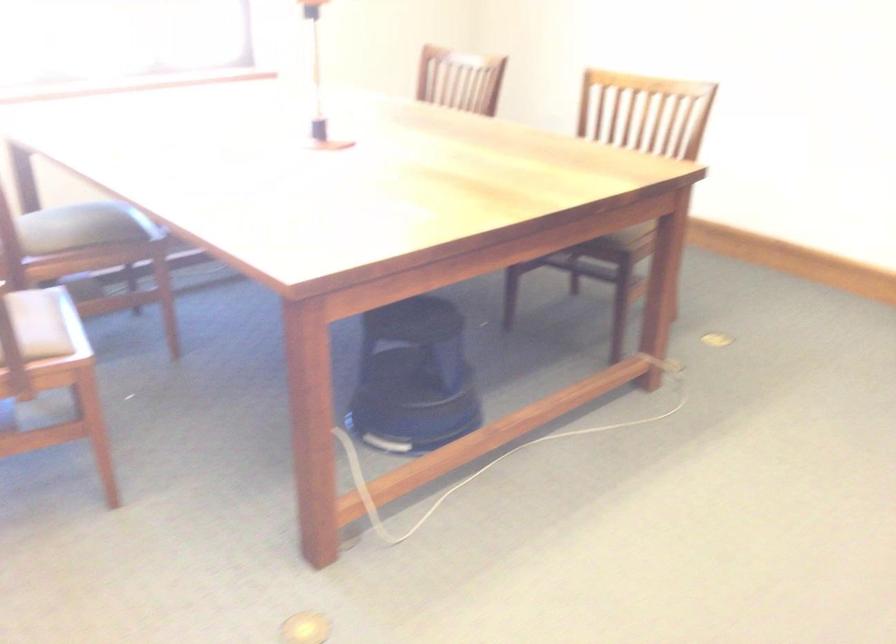
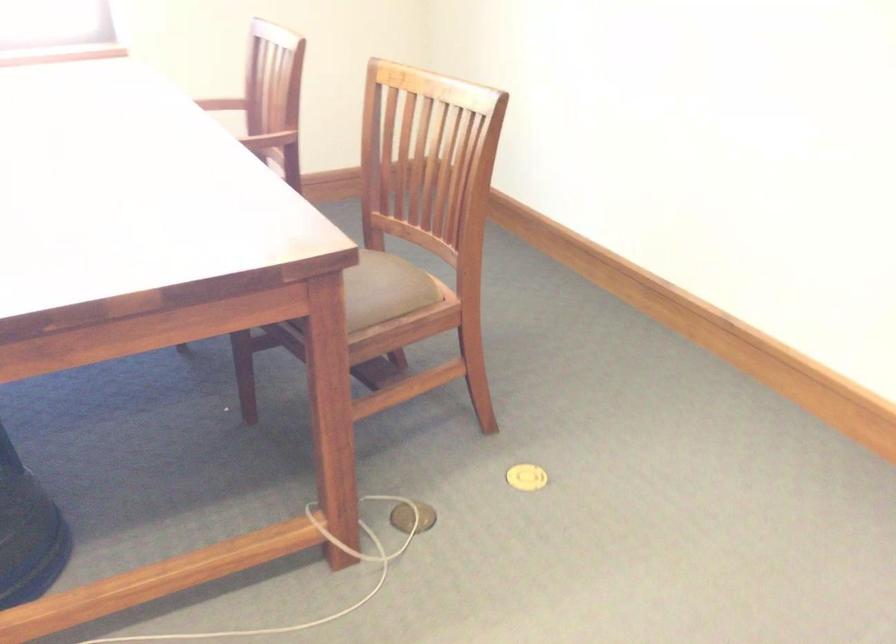
Find the pixel in the second image that matches the point at 724,337 in the first image.

(526, 477)